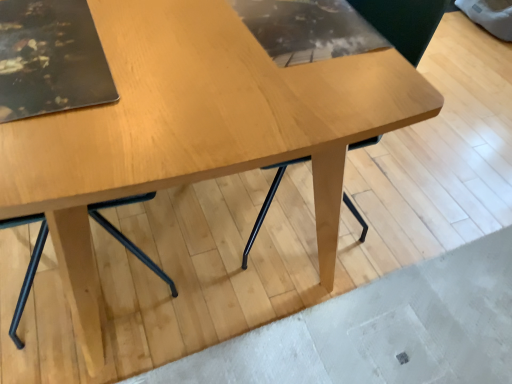
Locate an element on the screen. This screenshot has width=512, height=384. natural wood swivel chair at center is located at coordinates (352, 23).

Image resolution: width=512 pixels, height=384 pixels. What do you see at coordinates (352, 23) in the screenshot?
I see `natural wood swivel chair at center` at bounding box center [352, 23].

Locate an element on the screen. natural wood swivel chair at center is located at coordinates 352,23.